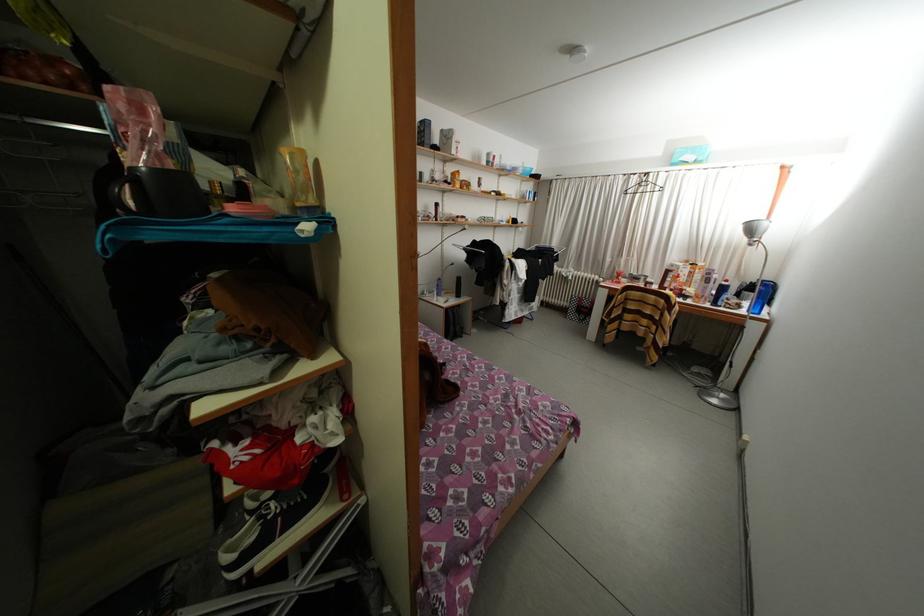
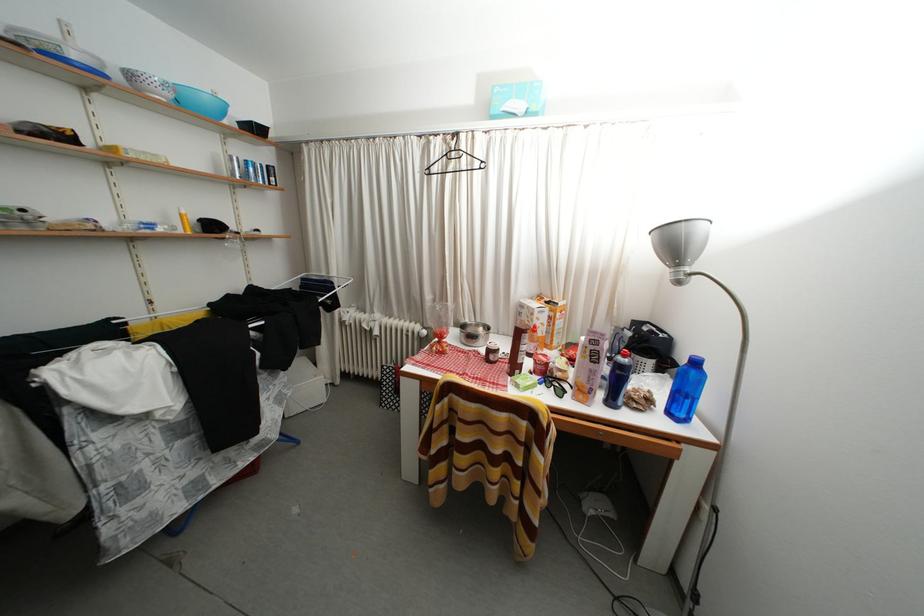
Find the pixel in the second image that matches (723,309) in the first image.

(618, 408)